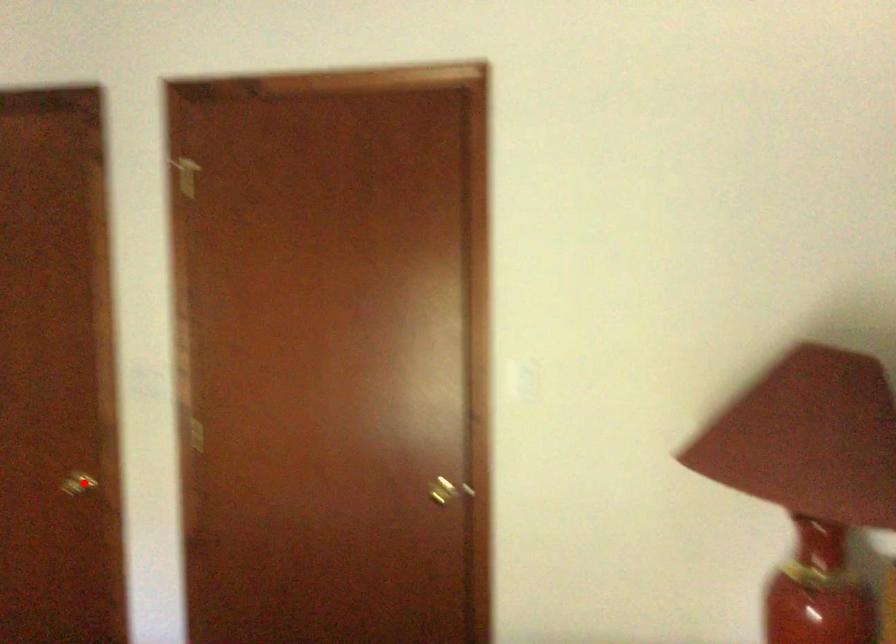
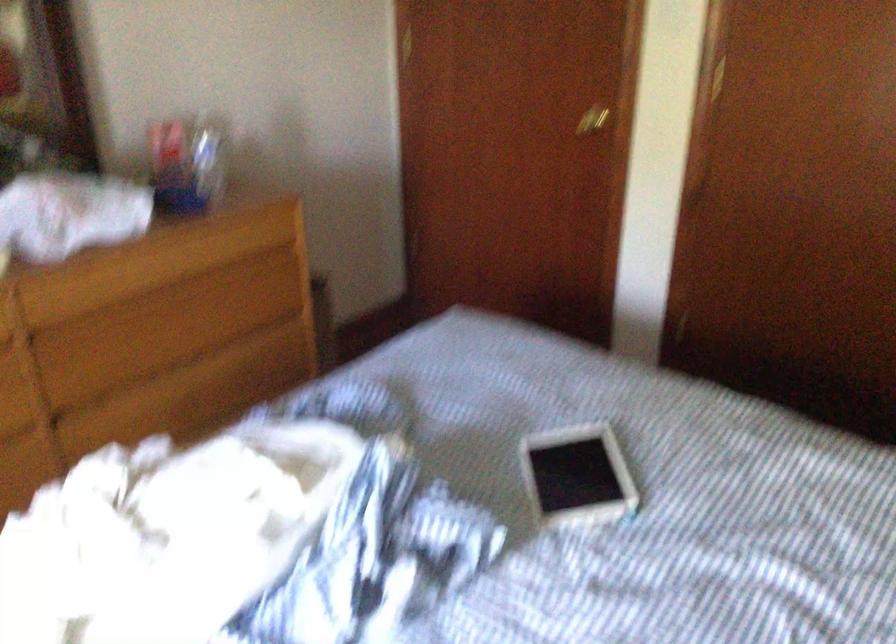
In the second image, find the point that corresponds to the highlighted location in the first image.

(592, 120)